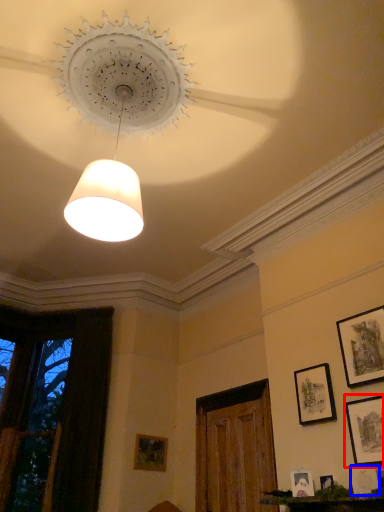
Question: Which object appears farthest to the camera in this image, picture frame (highlighted by a red box) or picture frame (highlighted by a blue box)?

Choices:
 (A) picture frame
 (B) picture frame

Answer: (A)